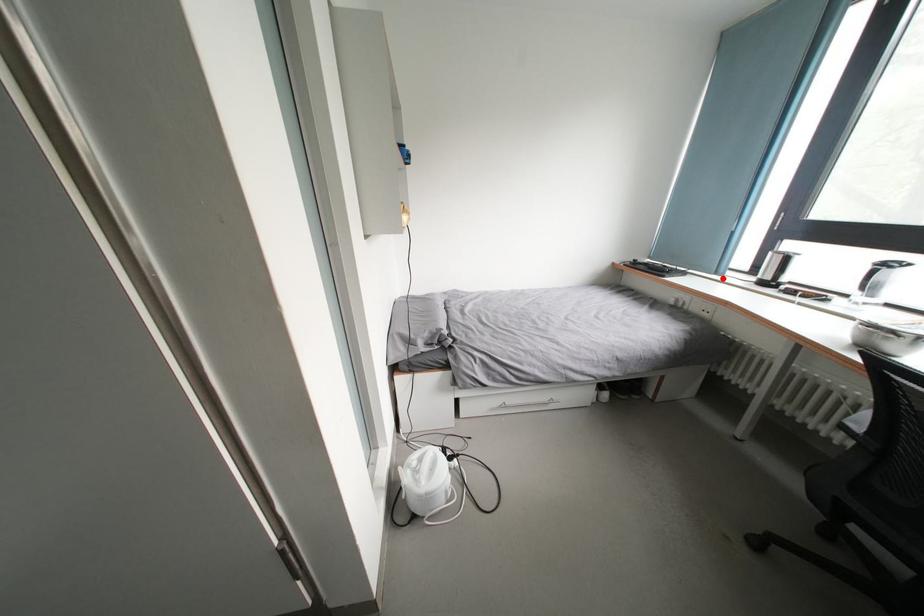
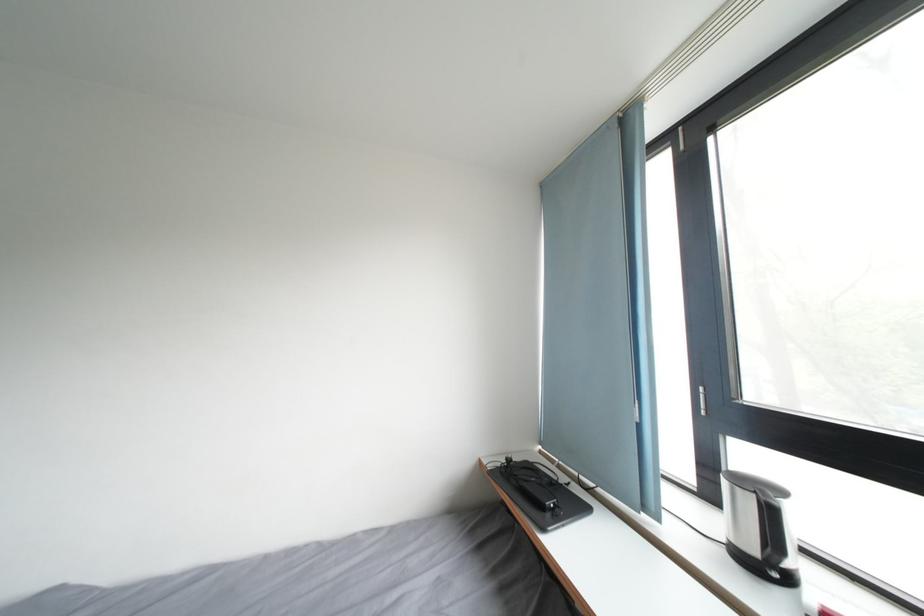
Where in the second image is the point corresponding to the highlighted location from the first image?

(651, 514)